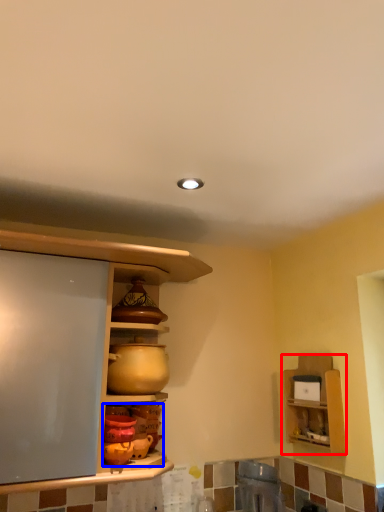
Question: Which point is further to the camera, shelf (highlighted by a red box) or pottery (highlighted by a blue box)?

Choices:
 (A) shelf
 (B) pottery

Answer: (A)